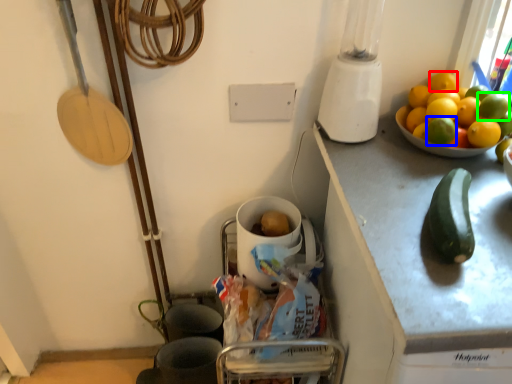
Question: Which is nearer to the lemon (highlighted by a red box)? lemon (highlighted by a blue box) or fruit (highlighted by a green box).

Choices:
 (A) lemon
 (B) fruit

Answer: (B)